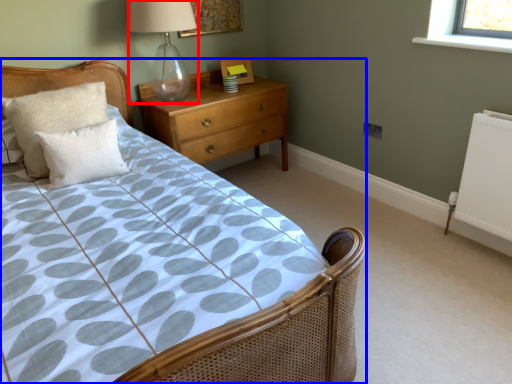
Question: Among these objects, which one is nearest to the camera, table lamp (highlighted by a red box) or bed (highlighted by a blue box)?

Choices:
 (A) table lamp
 (B) bed

Answer: (B)